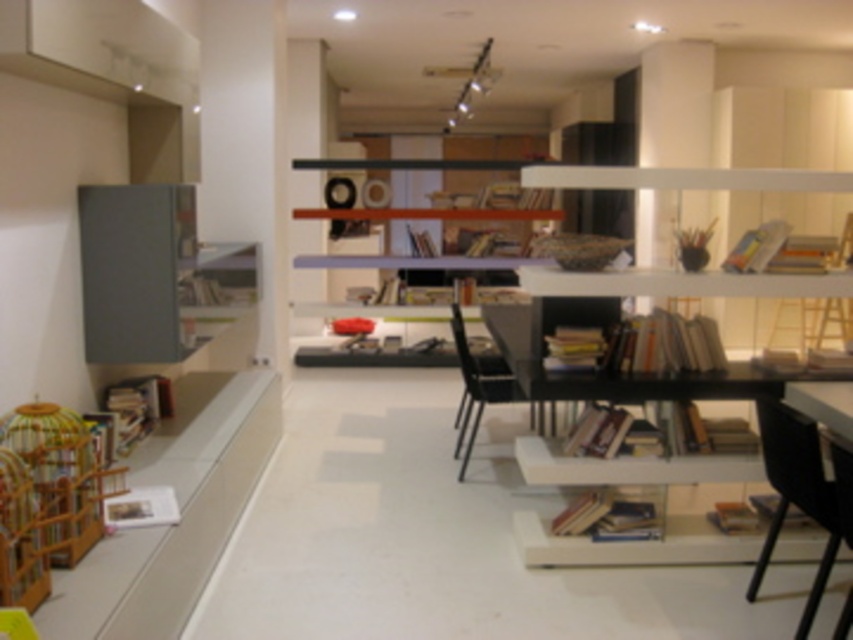
Where is `white matte bookshelf at upper right`? The width and height of the screenshot is (853, 640). white matte bookshelf at upper right is located at coordinates (680, 284).

Does white matte bookshelf at upper right appear over matte white bookshelf at center?

No.

Describe the element at coordinates (680, 284) in the screenshot. I see `white matte bookshelf at upper right` at that location.

You are a GUI agent. You are given a task and a screenshot of the screen. Output one action in this format:
    pyautogui.click(x=<x>, y=<y>)
    Task: Click on the white matte bookshelf at upper right
    The height and width of the screenshot is (640, 853).
    Given the screenshot: What is the action you would take?
    pyautogui.click(x=680, y=284)

Does point (775, 452) come closer to viewer compared to point (323, 209)?

Yes, point (775, 452) is in front of point (323, 209).

Which is above, black plastic chair at lower right or matte white bookshelf at center?

matte white bookshelf at center is higher up.

This screenshot has height=640, width=853. What do you see at coordinates (802, 492) in the screenshot?
I see `black plastic chair at lower right` at bounding box center [802, 492].

Image resolution: width=853 pixels, height=640 pixels. Find the location of `black plastic chair at lower right`. black plastic chair at lower right is located at coordinates (802, 492).

Which is behind, point (573, 291) or point (457, 310)?

Point (457, 310)

Is point (570, 461) closer to viewer compared to point (467, 353)?

Yes, point (570, 461) is closer to viewer.

Find the location of a particular element. white matte bookshelf at upper right is located at coordinates (680, 284).